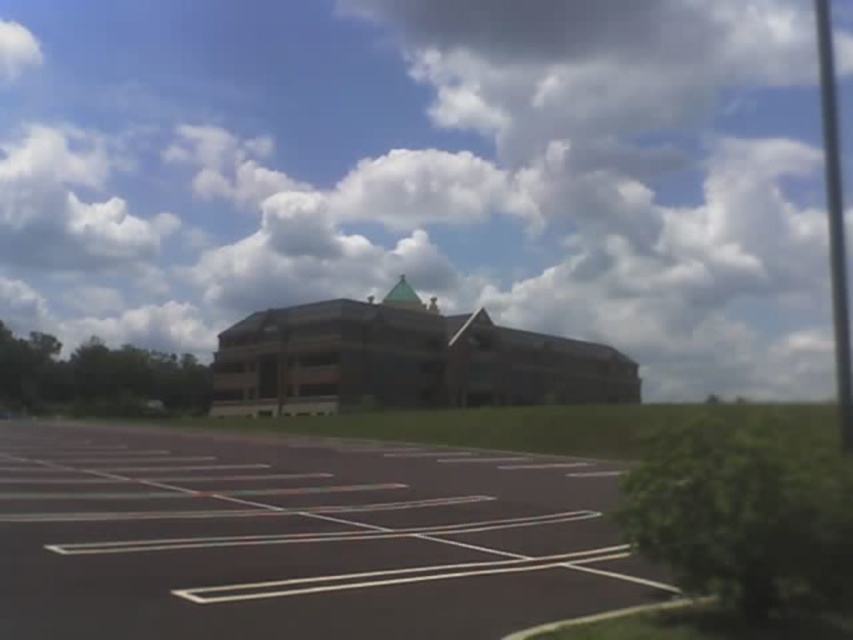
Question: Observing the image, what is the correct spatial positioning of cloudy sky at upper center in reference to black asphalt parking lot at center?

Choices:
 (A) below
 (B) above

Answer: (B)

Question: Can you confirm if cloudy sky at upper center is positioned above black asphalt parking lot at center?

Choices:
 (A) yes
 (B) no

Answer: (A)

Question: Among these points, which one is nearest to the camera?

Choices:
 (A) (387, 493)
 (B) (645, 250)

Answer: (A)

Question: Which object is farther from the camera taking this photo?

Choices:
 (A) cloudy sky at upper center
 (B) black asphalt parking lot at center

Answer: (A)

Question: In this image, where is cloudy sky at upper center located relative to black asphalt parking lot at center?

Choices:
 (A) below
 (B) above

Answer: (B)